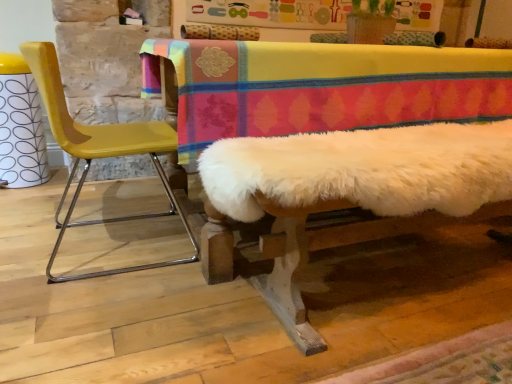
Describe the element at coordinates (98, 152) in the screenshot. I see `yellow fabric chair at left` at that location.

You are a GUI agent. You are given a task and a screenshot of the screen. Output one action in this format:
    pyautogui.click(x=<x>, y=<y>)
    Task: Click on the yellow fabric chair at left
    The height and width of the screenshot is (384, 512).
    Given the screenshot: What is the action you would take?
    pyautogui.click(x=98, y=152)

You are a GUI agent. You are given a task and a screenshot of the screen. Output one action in this format:
    pyautogui.click(x=<x>, y=<y>)
    Task: Click on the yellow fabric chair at left
    The image size is (512, 384).
    Given the screenshot: What is the action you would take?
    pyautogui.click(x=98, y=152)